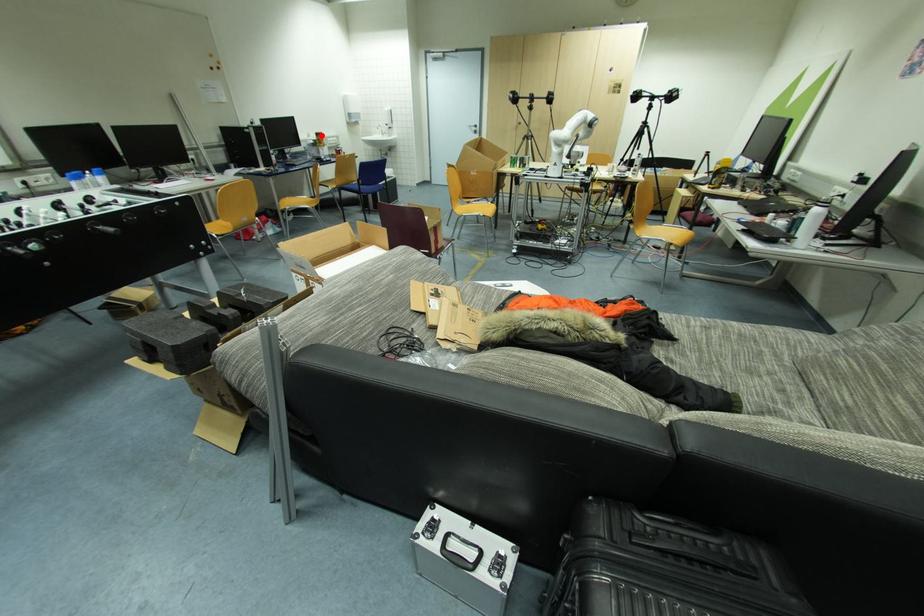
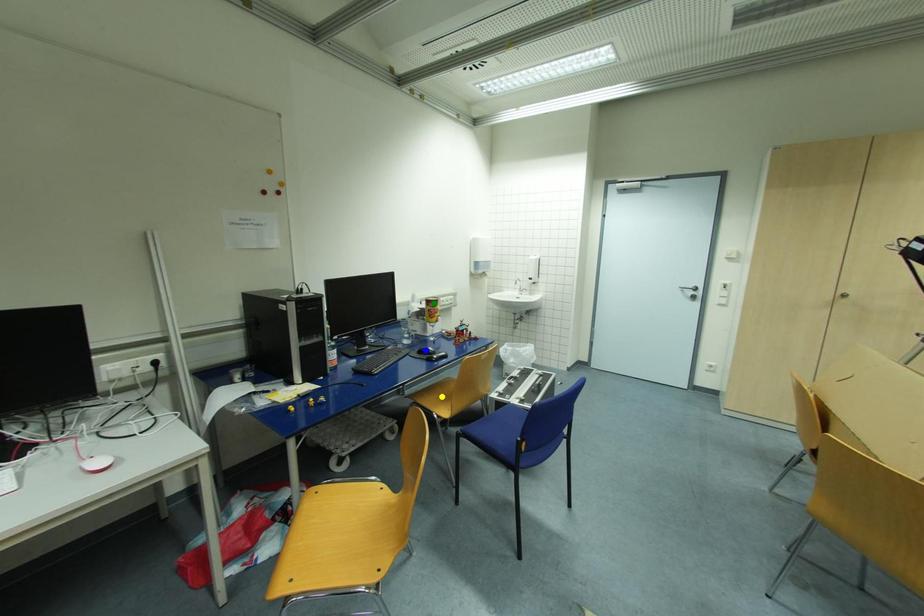
Question: I am providing you with two images of the same scene from different viewpoints. A red point is marked on the first image. You are given multiple points on the second image. Which spot in image 2 lines up with the point in image 1?

Choices:
 (A) blue point
 (B) yellow point
 (C) green point

Answer: (C)